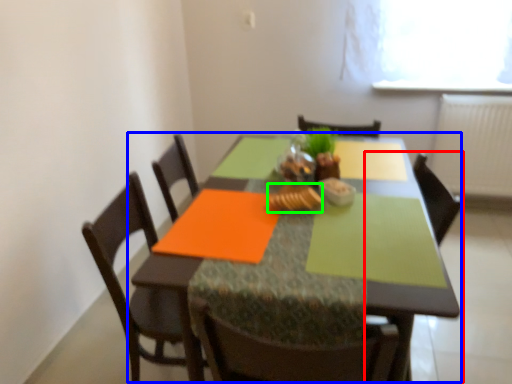
Question: Which object is positioned farthest from armchair (highlighted by a red box)? Select from kitchen & dining room table (highlighted by a blue box) and food (highlighted by a green box).

Choices:
 (A) kitchen & dining room table
 (B) food

Answer: (A)